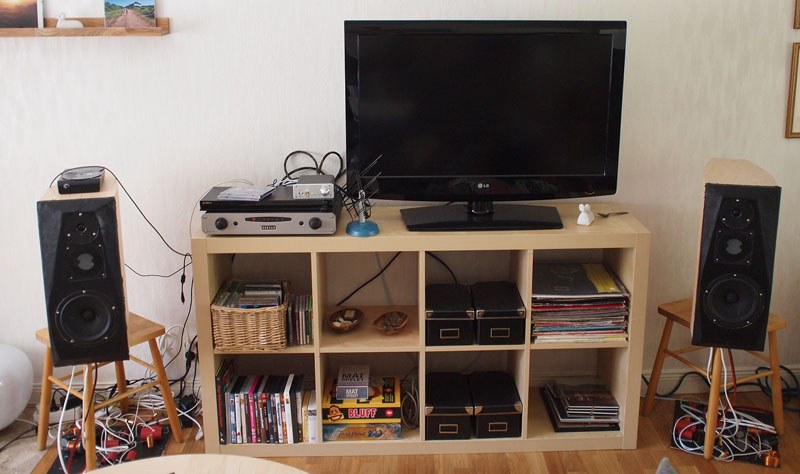
The width and height of the screenshot is (800, 474). I want to click on wood stool, so click(x=165, y=382), click(x=714, y=384).